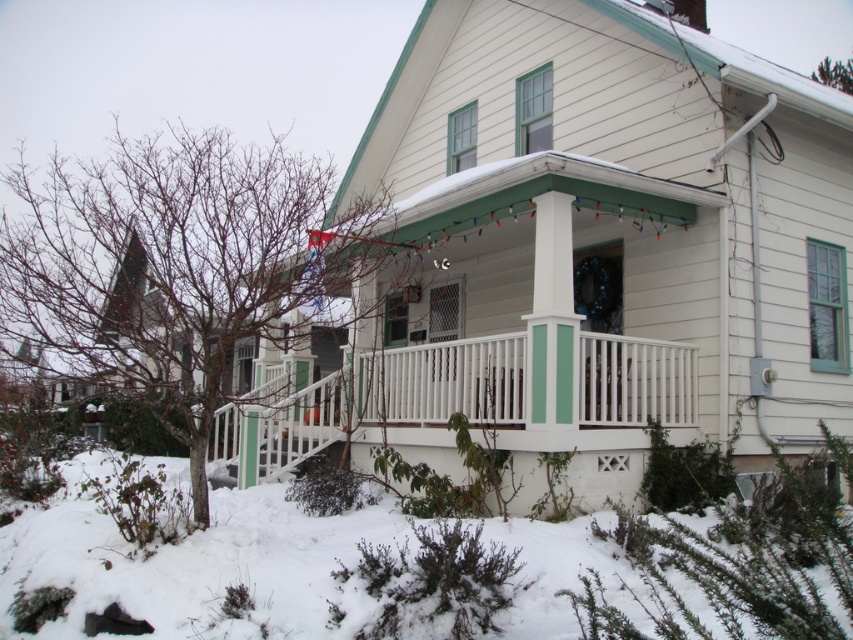
Question: Where is white fluffy snow at lower left located in relation to white painted wood porch at center in the image?

Choices:
 (A) below
 (B) above

Answer: (A)

Question: Which point is farther to the camera?

Choices:
 (A) white fluffy snow at lower left
 (B) white painted wood porch at center

Answer: (B)

Question: From the image, what is the correct spatial relationship of white fluffy snow at lower left in relation to white painted wood porch at center?

Choices:
 (A) above
 (B) below

Answer: (B)

Question: Is white fluffy snow at lower left closer to the viewer compared to white painted wood porch at center?

Choices:
 (A) yes
 (B) no

Answer: (A)

Question: Which point is farther to the camera?

Choices:
 (A) white fluffy snow at lower left
 (B) white painted wood porch at center

Answer: (B)

Question: Which point is closer to the camera?

Choices:
 (A) white fluffy snow at lower left
 (B) white painted wood porch at center

Answer: (A)